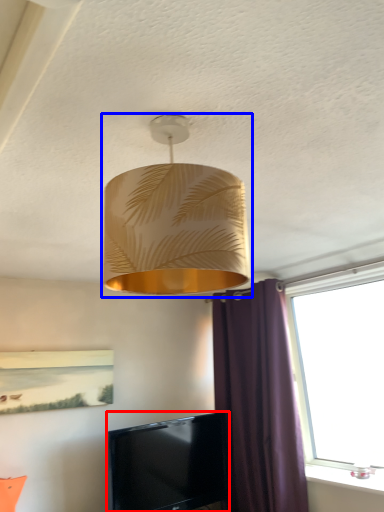
Question: Which point is closer to the camera, television (highlighted by a red box) or lamp (highlighted by a blue box)?

Choices:
 (A) television
 (B) lamp

Answer: (B)